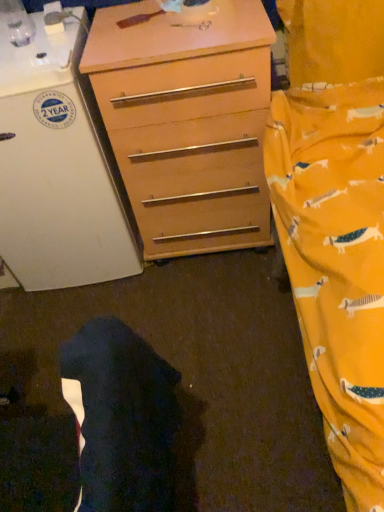
Question: Is white matte refrigerator at left at the back of wooden chest of drawers at center?

Choices:
 (A) yes
 (B) no

Answer: (B)

Question: Is wooden chest of drawers at center to the left of white matte refrigerator at left from the viewer's perspective?

Choices:
 (A) no
 (B) yes

Answer: (A)

Question: Is wooden chest of drawers at center facing towards white matte refrigerator at left?

Choices:
 (A) yes
 (B) no

Answer: (B)

Question: From a real-world perspective, is wooden chest of drawers at center located higher than white matte refrigerator at left?

Choices:
 (A) no
 (B) yes

Answer: (A)

Question: Is wooden chest of drawers at center shorter than white matte refrigerator at left?

Choices:
 (A) yes
 (B) no

Answer: (A)

Question: Is wooden chest of drawers at center taller or shorter than dark fabric robe at lower left?

Choices:
 (A) short
 (B) tall

Answer: (B)

Question: Is wooden chest of drawers at center wider or thinner than dark fabric robe at lower left?

Choices:
 (A) wide
 (B) thin

Answer: (A)

Question: From the image's perspective, is wooden chest of drawers at center positioned above or below dark fabric robe at lower left?

Choices:
 (A) below
 (B) above

Answer: (B)

Question: Relative to dark fabric robe at lower left, is wooden chest of drawers at center in front or behind?

Choices:
 (A) front
 (B) behind

Answer: (B)

Question: Based on their sizes in the image, would you say dark fabric robe at lower left is bigger or smaller than wooden chest of drawers at center?

Choices:
 (A) small
 (B) big

Answer: (A)

Question: Is point (132, 352) closer or farther from the camera than point (251, 75)?

Choices:
 (A) farther
 (B) closer

Answer: (B)

Question: From a real-world perspective, relative to wooden chest of drawers at center, is dark fabric robe at lower left vertically above or below?

Choices:
 (A) below
 (B) above

Answer: (B)

Question: Looking at their shapes, would you say dark fabric robe at lower left is wider or thinner than wooden chest of drawers at center?

Choices:
 (A) wide
 (B) thin

Answer: (B)

Question: In the image, is white matte refrigerator at left positioned in front of or behind wooden chest of drawers at center?

Choices:
 (A) behind
 (B) front

Answer: (B)

Question: Considering the positions of white matte refrigerator at left and wooden chest of drawers at center in the image, is white matte refrigerator at left wider or thinner than wooden chest of drawers at center?

Choices:
 (A) thin
 (B) wide

Answer: (B)